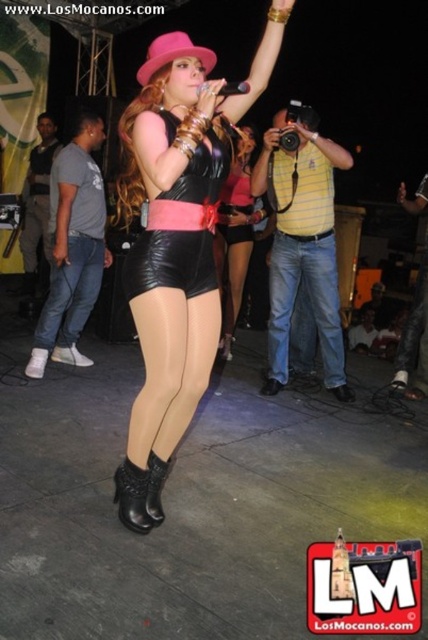
Question: Does jeans at center lie behind black leather boot at lower center?

Choices:
 (A) yes
 (B) no

Answer: (A)

Question: Which point appears closest to the camera in this image?

Choices:
 (A) (330, 268)
 (B) (240, 202)
 (C) (202, 275)

Answer: (C)

Question: Which point is closer to the camera?

Choices:
 (A) pink felt hat at upper center
 (B) leather shorts at center

Answer: (A)

Question: From the image, what is the correct spatial relationship of matte black leather shorts at center in relation to jeans at center?

Choices:
 (A) left
 (B) right

Answer: (A)

Question: Which object is positioned farthest from the black leather boot at lower center?

Choices:
 (A) matte black leather shorts at center
 (B) pink felt hat at upper center

Answer: (B)

Question: Is jeans at center thinner than pink felt hat at upper center?

Choices:
 (A) no
 (B) yes

Answer: (A)